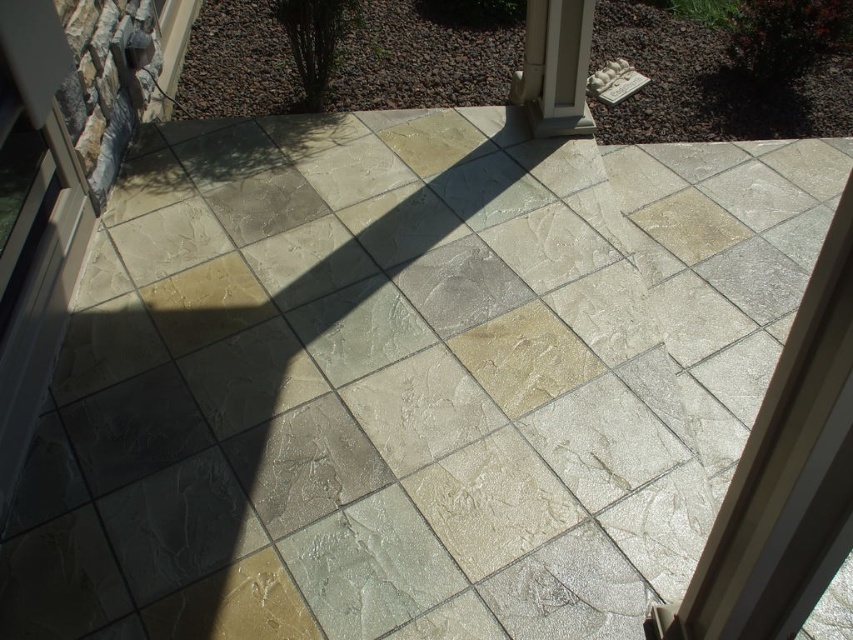
Can you confirm if white plastic screen door at left is thinner than white stone pillar at upper right?

Correct, white plastic screen door at left's width is less than white stone pillar at upper right's.

The height and width of the screenshot is (640, 853). Describe the element at coordinates (33, 221) in the screenshot. I see `white plastic screen door at left` at that location.

Find the location of a particular element. The image size is (853, 640). white plastic screen door at left is located at coordinates (33, 221).